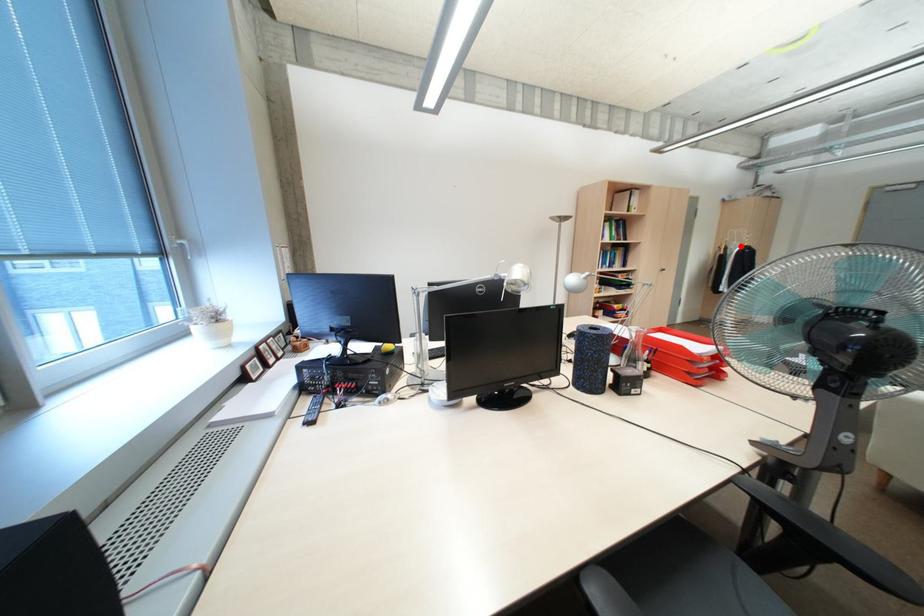
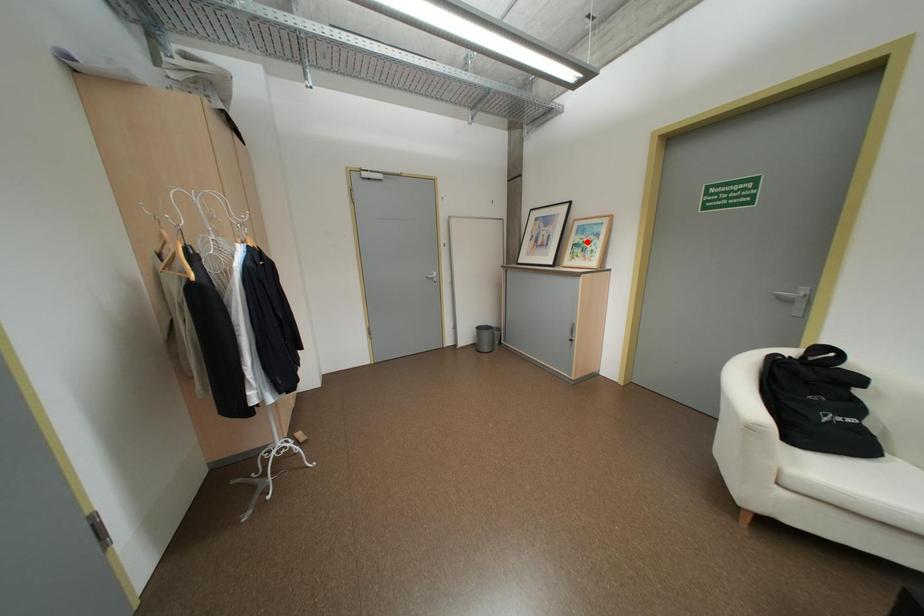
I am providing you with two images of the same scene from different viewpoints. A red point is marked on the first image and another point is marked on the second image. Is the red point in image1 aligned with the point shown in image2?

No